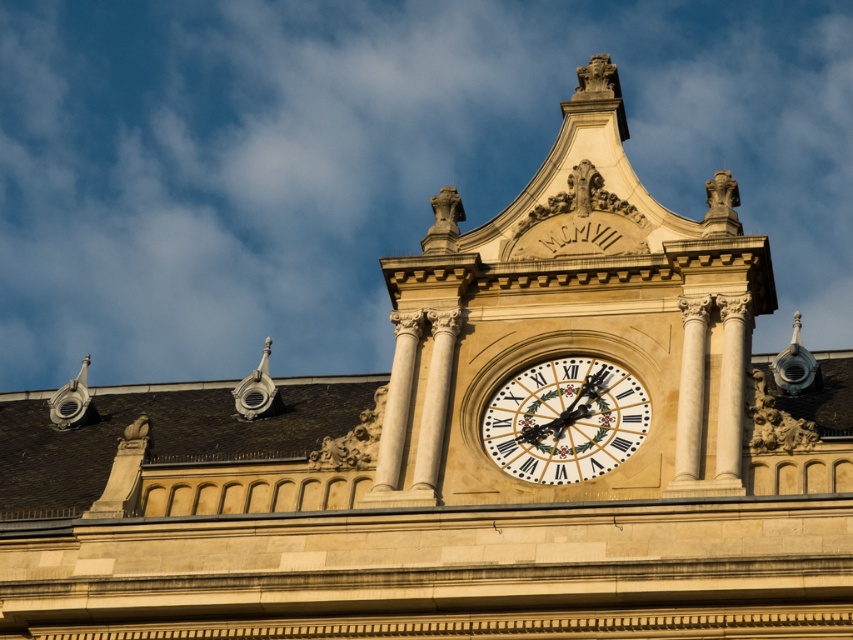
You are an architect examining the building facade. You notice two clocks at the center of the structure. The beige stone clock at center and the gold textured clock at center. Which one is closer to the edge of the building facade?

The beige stone clock at center and gold textured clock at center are 1.21 meters apart, but the description does not specify their positions relative to the edge of the building facade. Therefore, it is impossible to determine which one is closer to the edge based on the provided information.

Looking at this image, you are an architect examining the building facade. You notice two clocks at the center of the structure. Which one is closer to you, the beige stone clock at center or the gold textured clock at center?

The beige stone clock at center is closer to you since it is in front of the gold textured clock at center.